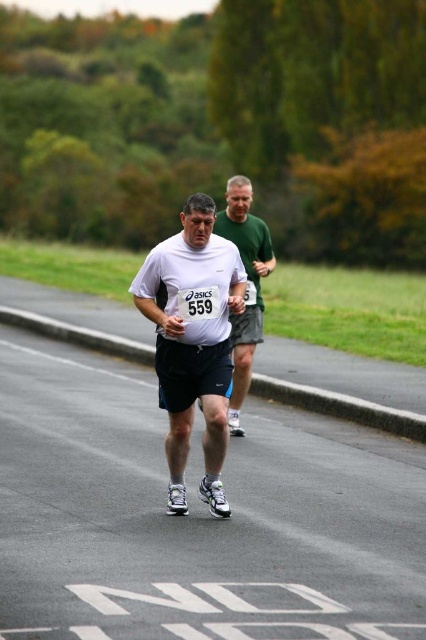
Question: Which object appears farthest from the camera in this image?

Choices:
 (A) white matte shorts at center
 (B) white matte shirt at center

Answer: (B)

Question: In this image, where is white matte shorts at center located relative to white matte shirt at center?

Choices:
 (A) left
 (B) right

Answer: (A)

Question: From the image, what is the correct spatial relationship of white matte shorts at center in relation to white matte shirt at center?

Choices:
 (A) left
 (B) right

Answer: (A)

Question: Among these objects, which one is farthest from the camera?

Choices:
 (A) white matte shirt at center
 (B) white matte shorts at center

Answer: (A)

Question: Among these objects, which one is farthest from the camera?

Choices:
 (A) white matte shirt at center
 (B) white matte shorts at center

Answer: (A)

Question: Does white matte shorts at center appear under white matte shirt at center?

Choices:
 (A) no
 (B) yes

Answer: (B)